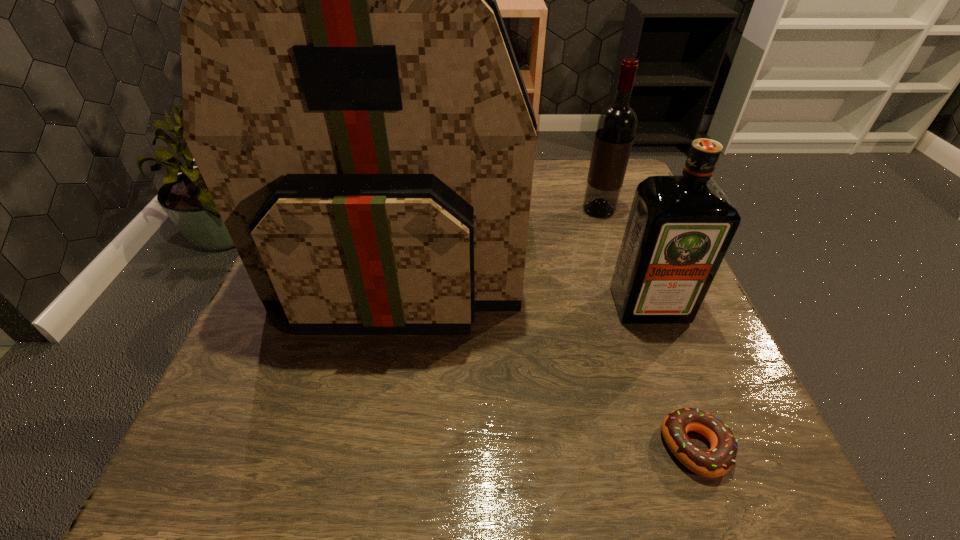
The width and height of the screenshot is (960, 540). I want to click on free space at the near edge of the desktop, so click(x=484, y=478).

Locate an element on the screen. blank space at the left edge is located at coordinates (287, 321).

This screenshot has height=540, width=960. In order to click on free space at the right edge of the desktop in this screenshot , I will do `click(709, 355)`.

This screenshot has width=960, height=540. What are the coordinates of `unoccupied position between the wine bottle and the shortest object` in the screenshot? It's located at (647, 329).

Locate an element on the screen. empty location between the liquor and the doughnut is located at coordinates (672, 376).

The height and width of the screenshot is (540, 960). Identify the location of vacant space that's between the shortest object and the liquor. (672, 376).

You are a GUI agent. You are given a task and a screenshot of the screen. Output one action in this format:
    pyautogui.click(x=<x>, y=<y>)
    Task: Click on the free space between the doughnut and the liquor
    The image size is (960, 540).
    Given the screenshot: What is the action you would take?
    pyautogui.click(x=672, y=376)

Image resolution: width=960 pixels, height=540 pixels. I want to click on vacant point located between the doughnut and the backpack, so click(x=550, y=352).

The image size is (960, 540). In order to click on empty location between the liquor and the backpack in this screenshot , I will do `click(526, 281)`.

This screenshot has width=960, height=540. What are the coordinates of `free spot between the leftmost object and the doughnut` in the screenshot? It's located at (550, 352).